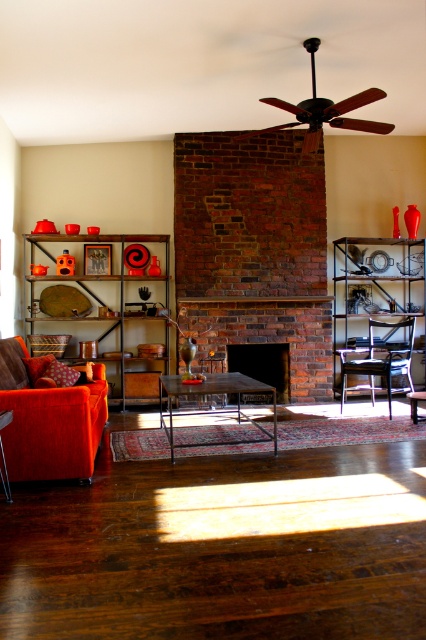
Based on the photo, is metallic black bookshelf at center-right behind matte black chair at center?

Yes, metallic black bookshelf at center-right is further from the viewer.

Is point (336, 385) positioned before point (379, 349)?

No, it is not.

Find the location of a particular element. This screenshot has width=426, height=640. metallic black bookshelf at center-right is located at coordinates (374, 285).

Is metallic black bookshelf at center-right wider than brick fireplace at center?

Correct, the width of metallic black bookshelf at center-right exceeds that of brick fireplace at center.

Where is `metallic black bookshelf at center-right`? This screenshot has width=426, height=640. metallic black bookshelf at center-right is located at coordinates (374, 285).

Is matte black chair at center to the left of metallic/textured coffee table at center from the viewer's perspective?

Incorrect, matte black chair at center is not on the left side of metallic/textured coffee table at center.

Which is in front, point (388, 364) or point (169, 449)?

Point (169, 449)

You are a GUI agent. You are given a task and a screenshot of the screen. Output one action in this format:
    pyautogui.click(x=<x>, y=<y>)
    Task: Click on the matte black chair at center
    Image resolution: width=426 pixels, height=640 pixels.
    Given the screenshot: What is the action you would take?
    pyautogui.click(x=379, y=358)